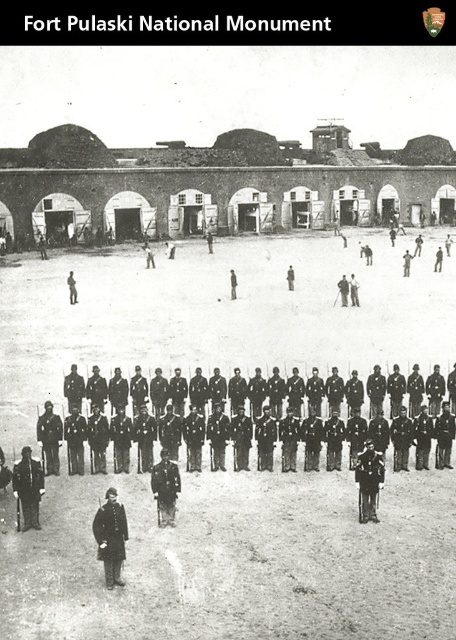
Question: Which of the following is the farthest from the observer?

Choices:
 (A) dark brown leather coat at center
 (B) dark uniform at center

Answer: (B)

Question: Which point is closer to the camera taking this photo?

Choices:
 (A) (67, 284)
 (B) (124, 516)

Answer: (B)

Question: Where is dark brown leather coat at center located in relation to dark uniform at center in the image?

Choices:
 (A) below
 (B) above

Answer: (A)

Question: Does dark brown leather coat at center appear on the left side of dark uniform at center?

Choices:
 (A) no
 (B) yes

Answer: (A)

Question: Does dark brown leather coat at center lie behind dark uniform at center?

Choices:
 (A) no
 (B) yes

Answer: (A)